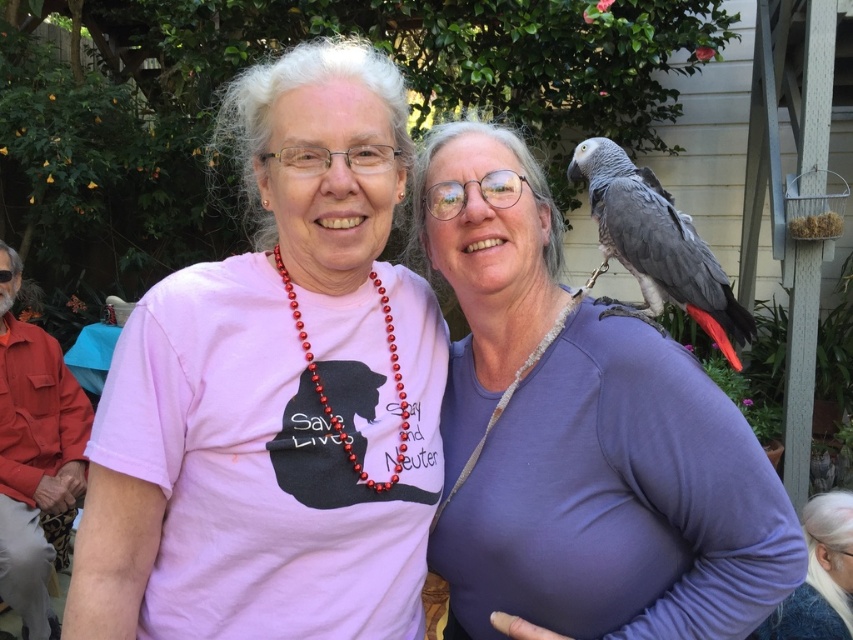
Can you confirm if matte gray parrot at upper right is positioned below gray matte parrot at upper right?

Correct, matte gray parrot at upper right is located below gray matte parrot at upper right.

Between point (715, 432) and point (630, 269), which one is positioned behind?

The point (630, 269) is more distant.

Find the location of a particular element. matte gray parrot at upper right is located at coordinates (579, 438).